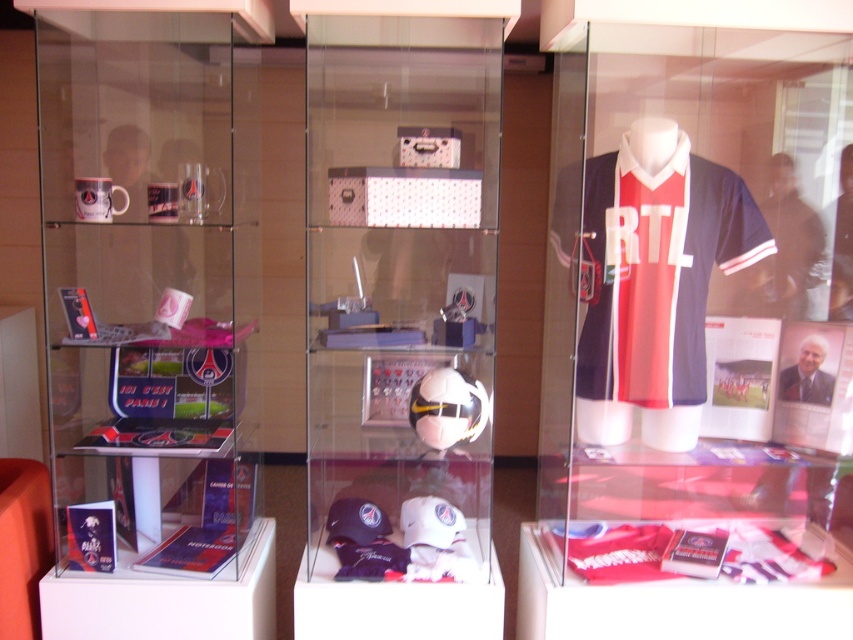
Which is above, matte jersey at center or white glossy soccer ball at center?

white glossy soccer ball at center

How much distance is there between matte jersey at center and white glossy soccer ball at center?

24.06 inches

The image size is (853, 640). In order to click on matte jersey at center in this screenshot , I will do `click(695, 324)`.

Locate an element on the screen. The height and width of the screenshot is (640, 853). matte jersey at center is located at coordinates (695, 324).